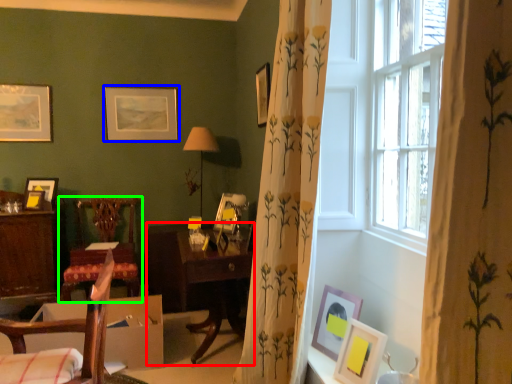
Question: Based on their relative distances, which object is farther from table (highlighted by a red box)? Choose from picture frame (highlighted by a blue box) and chair (highlighted by a green box).

Choices:
 (A) picture frame
 (B) chair

Answer: (A)